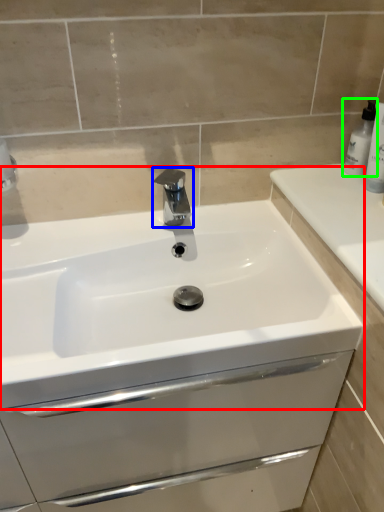
Question: Estimate the real-world distances between objects in this image. Which object is closer to sink (highlighted by a red box), tap (highlighted by a blue box) or soap dispenser (highlighted by a green box)?

Choices:
 (A) tap
 (B) soap dispenser

Answer: (A)